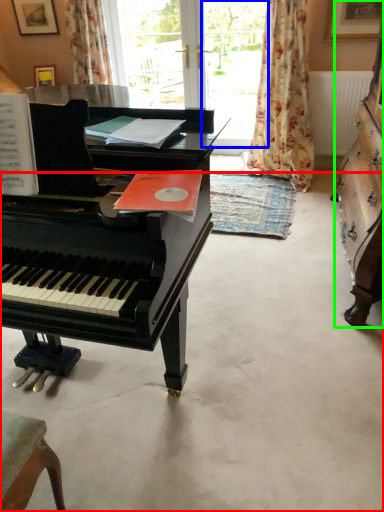
Question: Which is farther away from concrete (highlighted by a red box)? window screen (highlighted by a blue box) or harpsichord (highlighted by a green box)?

Choices:
 (A) window screen
 (B) harpsichord

Answer: (A)